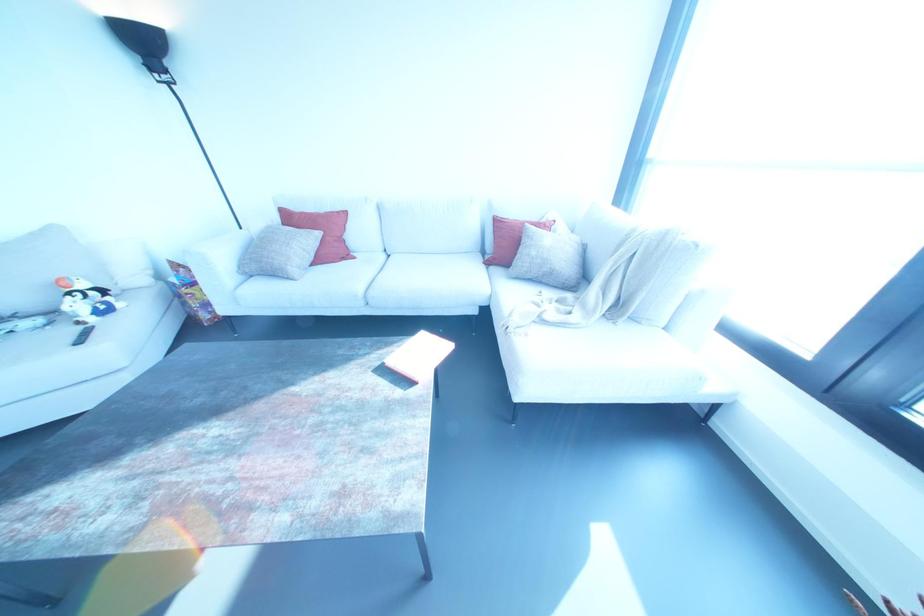
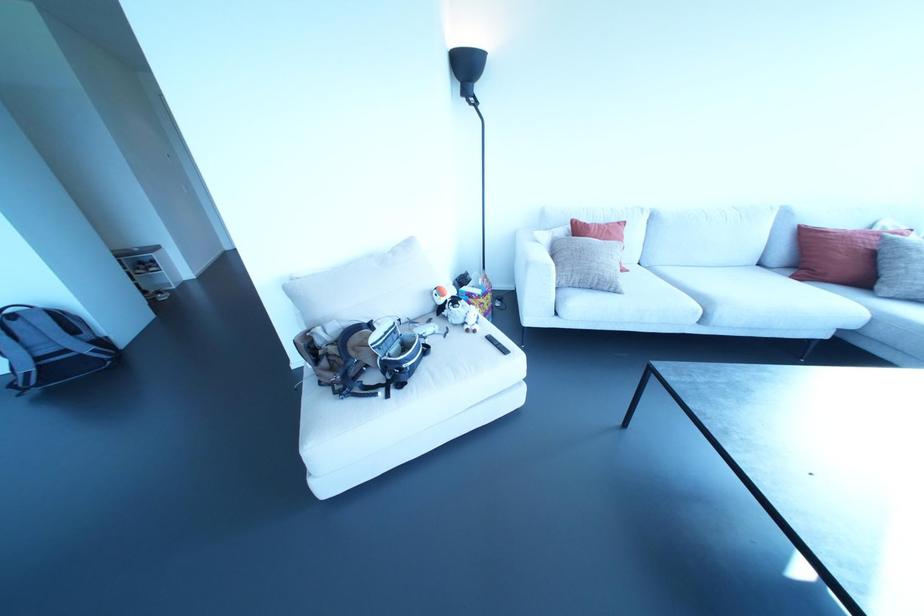
Where in the second image is the point corresponding to pixel 78 322 from the first image?

(467, 330)